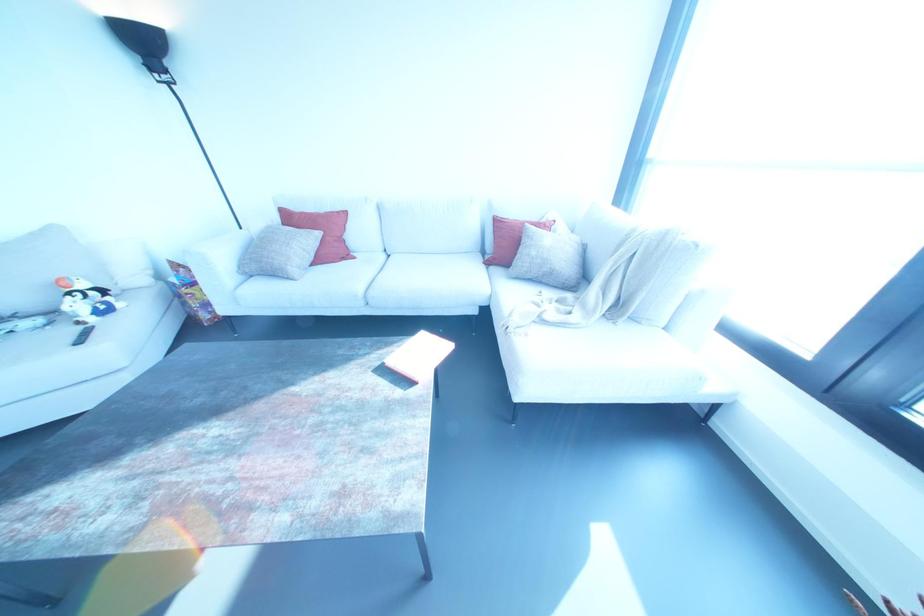
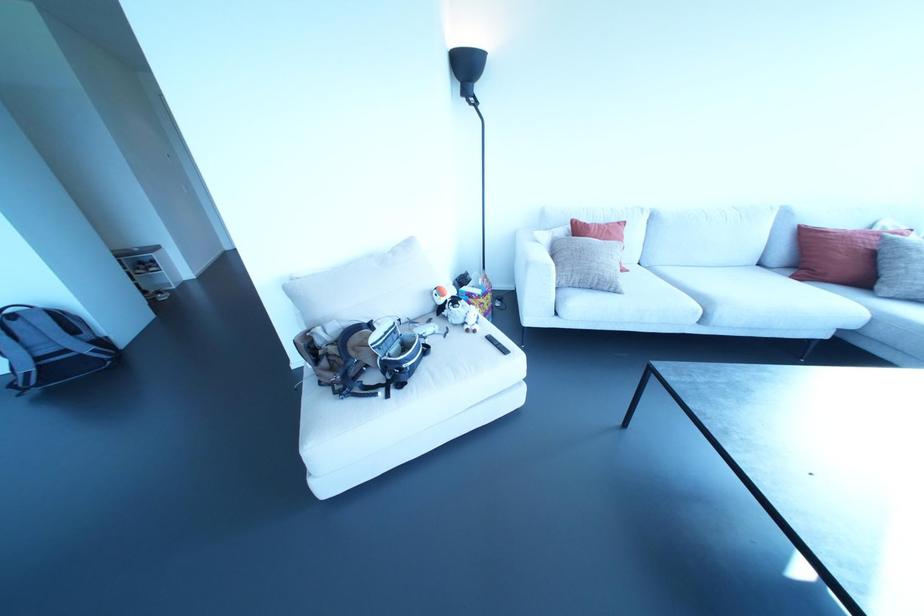
Where in the second image is the point corresponding to pixel 78 322 from the first image?

(467, 330)